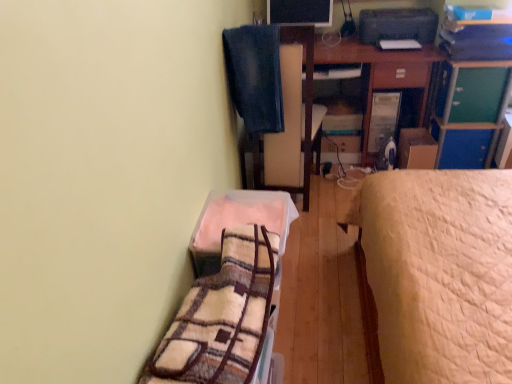
Question: Considering the relative sizes of denim at upper center, which is the 1th blanket from back to front, and wooden desk at upper right in the image provided, is denim at upper center, which is the 1th blanket from back to front, taller than wooden desk at upper right?

Choices:
 (A) yes
 (B) no

Answer: (B)

Question: Considering the relative positions of denim at upper center, placed as the first blanket when sorted from top to bottom, and wooden desk at upper right in the image provided, is denim at upper center, placed as the first blanket when sorted from top to bottom, to the left of wooden desk at upper right from the viewer's perspective?

Choices:
 (A) no
 (B) yes

Answer: (B)

Question: From the image's perspective, is denim at upper center, which is the 1th blanket from back to front, on wooden desk at upper right?

Choices:
 (A) yes
 (B) no

Answer: (B)

Question: Can you confirm if denim at upper center, placed as the first blanket when sorted from top to bottom, is positioned to the right of wooden desk at upper right?

Choices:
 (A) no
 (B) yes

Answer: (A)

Question: Is the position of denim at upper center, which is the 1th blanket from back to front, more distant than that of wooden desk at upper right?

Choices:
 (A) no
 (B) yes

Answer: (A)

Question: Considering the relative sizes of denim at upper center, placed as the first blanket when sorted from top to bottom, and wooden desk at upper right in the image provided, is denim at upper center, placed as the first blanket when sorted from top to bottom, wider than wooden desk at upper right?

Choices:
 (A) yes
 (B) no

Answer: (B)

Question: Could you tell me if fuzzy fabric blanket at lower left is facing denim at upper center, placed as the first blanket when sorted from top to bottom?

Choices:
 (A) no
 (B) yes

Answer: (A)

Question: Would you say fuzzy fabric blanket at lower left is outside denim at upper center, which is the 1th blanket from back to front?

Choices:
 (A) yes
 (B) no

Answer: (A)

Question: Is fuzzy fabric blanket at lower left to the right of denim at upper center, placed as the first blanket when sorted from top to bottom, from the viewer's perspective?

Choices:
 (A) yes
 (B) no

Answer: (B)

Question: Is fuzzy fabric blanket at lower left taller than denim at upper center, which is the 1th blanket from back to front?

Choices:
 (A) no
 (B) yes

Answer: (A)

Question: Considering the relative sizes of fuzzy fabric blanket at lower left and denim at upper center, placed as the first blanket when sorted from top to bottom, in the image provided, is fuzzy fabric blanket at lower left wider than denim at upper center, placed as the first blanket when sorted from top to bottom,?

Choices:
 (A) no
 (B) yes

Answer: (A)

Question: Considering the relative sizes of fuzzy fabric blanket at lower left and denim at upper center, the second blanket in the front-to-back sequence, in the image provided, is fuzzy fabric blanket at lower left bigger than denim at upper center, the second blanket in the front-to-back sequence,?

Choices:
 (A) no
 (B) yes

Answer: (A)

Question: Does wooden desk at upper right have a lesser height compared to matte black monitor at upper center?

Choices:
 (A) yes
 (B) no

Answer: (B)